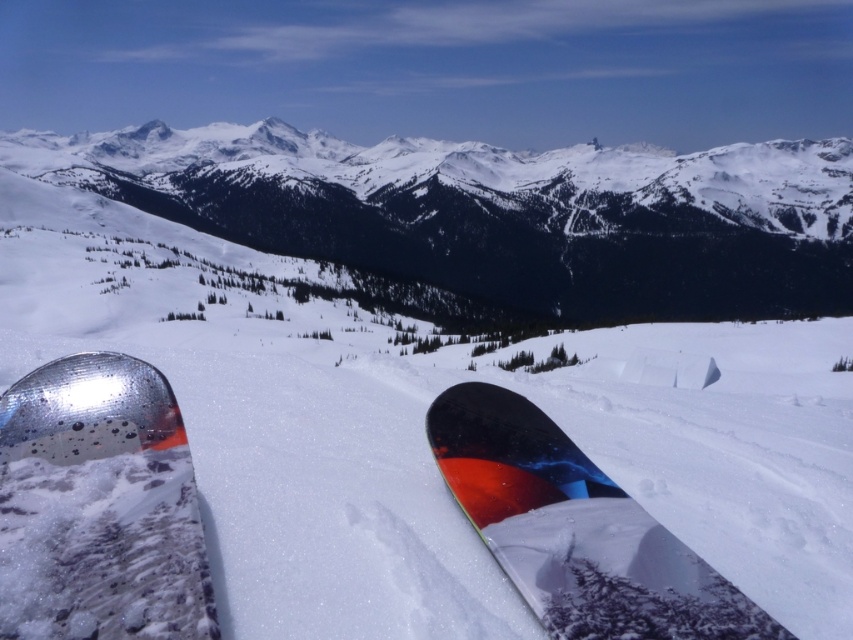
You are a winter sports instructor standing at the base of the slope. You see the glossy metallic snowboard at lower left and the shiny black snowboard at center. A student asks which snowboard is closer to the starting point of the slope. Based on the scene, how would you determine which one is closer?

The glossy metallic snowboard at lower left is 10.38 meters away from the shiny black snowboard at center. Since the student is asking about proximity to the starting point, we need to consider their positions relative to it. However, the description only provides the distance between the two snowboards. Without additional information about their exact locations relative to the starting point, it is impossible to determine which is closer. The available data only confirms the distance between them, not from

You are standing at the point where the snowboards are placed and want to reach a cabin located 1000 feet away from you. Can you determine if the cabin is closer to you than the point labeled as point (421, 208)?

The point (421, 208) is 1052.38 feet away from you, so the cabin located 1000 feet away is closer to you than the point (421, 208).